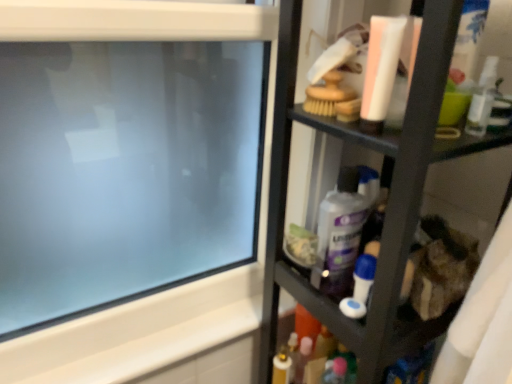
Question: From the image's perspective, is blue plastic toothbrush at center-right below transparent glass computer screen at upper left?

Choices:
 (A) yes
 (B) no

Answer: (A)

Question: Does blue plastic toothbrush at center-right touch transparent glass computer screen at upper left?

Choices:
 (A) yes
 (B) no

Answer: (B)

Question: Considering the relative positions of blue plastic toothbrush at center-right and transparent glass computer screen at upper left in the image provided, is blue plastic toothbrush at center-right to the left of transparent glass computer screen at upper left from the viewer's perspective?

Choices:
 (A) yes
 (B) no

Answer: (B)

Question: Is blue plastic toothbrush at center-right behind transparent glass computer screen at upper left?

Choices:
 (A) no
 (B) yes

Answer: (B)

Question: Does blue plastic toothbrush at center-right have a greater height compared to transparent glass computer screen at upper left?

Choices:
 (A) yes
 (B) no

Answer: (B)

Question: Based on their positions, is purple glossy bottle at center located to the left or right of transparent glass computer screen at upper left?

Choices:
 (A) right
 (B) left

Answer: (A)

Question: Is purple glossy bottle at center bigger or smaller than transparent glass computer screen at upper left?

Choices:
 (A) small
 (B) big

Answer: (A)

Question: Is purple glossy bottle at center wider or thinner than transparent glass computer screen at upper left?

Choices:
 (A) thin
 (B) wide

Answer: (A)

Question: From the image's perspective, relative to transparent glass computer screen at upper left, is purple glossy bottle at center above or below?

Choices:
 (A) below
 (B) above

Answer: (A)

Question: Based on their positions, is transparent glass computer screen at upper left located to the left or right of purple glossy bottle at center?

Choices:
 (A) right
 (B) left

Answer: (B)

Question: Looking at the image, does transparent glass computer screen at upper left seem bigger or smaller compared to purple glossy bottle at center?

Choices:
 (A) small
 (B) big

Answer: (B)

Question: From the image's perspective, is transparent glass computer screen at upper left above or below purple glossy bottle at center?

Choices:
 (A) below
 (B) above

Answer: (B)

Question: From a real-world perspective, relative to purple glossy bottle at center, is transparent glass computer screen at upper left vertically above or below?

Choices:
 (A) below
 (B) above

Answer: (B)

Question: In terms of height, does transparent glass computer screen at upper left look taller or shorter compared to black plastic shelf at right?

Choices:
 (A) short
 (B) tall

Answer: (A)

Question: Considering the positions of point (158, 218) and point (342, 135), is point (158, 218) closer or farther from the camera than point (342, 135)?

Choices:
 (A) closer
 (B) farther

Answer: (B)